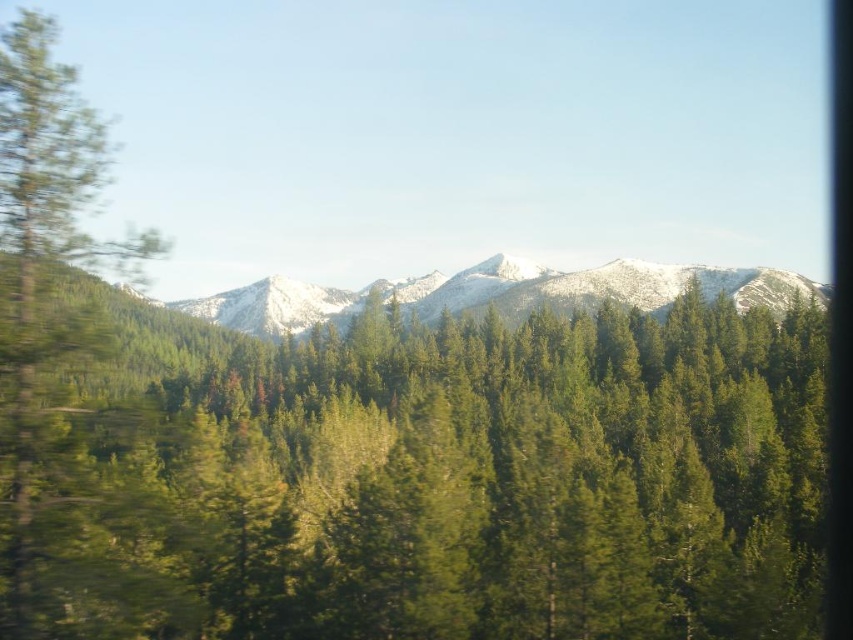
Is green matte tree at left smaller than snowy mountain range at center?

Yes, green matte tree at left is smaller than snowy mountain range at center.

Who is more forward, (13, 524) or (526, 301)?

Positioned in front is point (13, 524).

Identify the location of green matte tree at left. The image size is (853, 640). (44, 312).